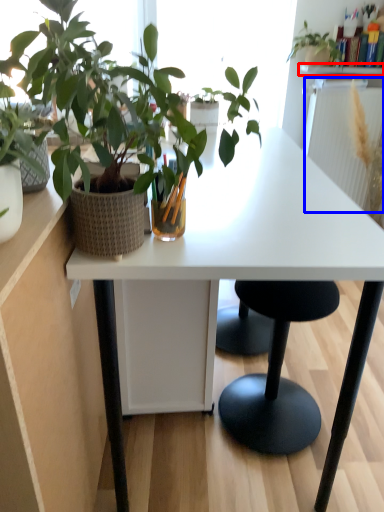
Question: Which object is further to the camera taking this photo, window sill (highlighted by a red box) or radiator (highlighted by a blue box)?

Choices:
 (A) window sill
 (B) radiator

Answer: (A)